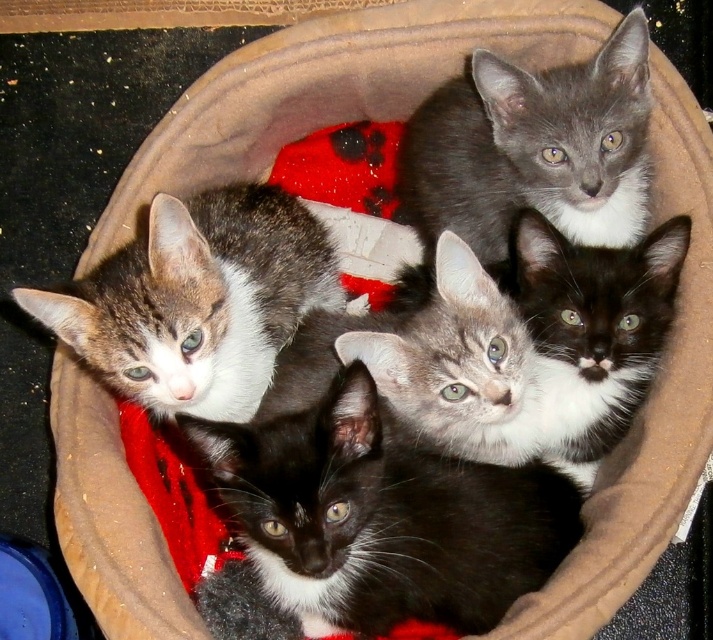
Is black fur/kitten at center to the left of speckled fur kitten at upper left from the viewer's perspective?

No, black fur/kitten at center is not to the left of speckled fur kitten at upper left.

Who is more forward, (426,522) or (279,218)?

Point (426,522)

Is point (386, 561) behind point (252, 326)?

That is False.

Where is `black fur/kitten at center`? Image resolution: width=713 pixels, height=640 pixels. black fur/kitten at center is located at coordinates (381, 516).

Is black fur/kitten at center bigger than gray soft kitten at upper center?

Yes.

Find the location of `black fur/kitten at center`. black fur/kitten at center is located at coordinates (381, 516).

Is point (379, 561) in front of point (627, 177)?

Yes, it is.

The width and height of the screenshot is (713, 640). I want to click on black fur/kitten at center, so pyautogui.click(x=381, y=516).

Is speckled fur kitten at upper left shorter than gray soft kitten at upper center?

No.

Is point (120, 371) closer to viewer compared to point (506, 205)?

Yes.

I want to click on speckled fur kitten at upper left, so click(198, 300).